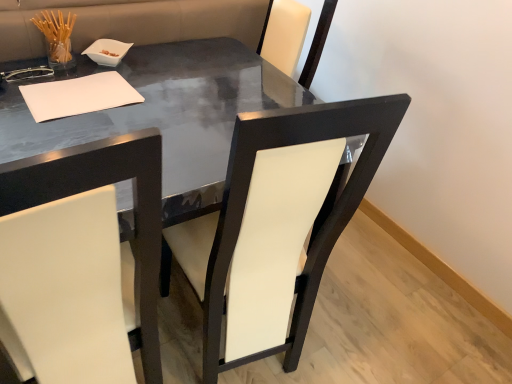
Question: From a real-world perspective, is white leather chair at left, positioned as the second chair in right-to-left order, physically located above or below white leather chair at center, arranged as the 2th chair when viewed from the left?

Choices:
 (A) above
 (B) below

Answer: (B)

Question: Considering the positions of point (44, 188) and point (266, 284), is point (44, 188) closer or farther from the camera than point (266, 284)?

Choices:
 (A) closer
 (B) farther

Answer: (A)

Question: Which of these objects is positioned farthest from the white leather chair at center, which is counted as the 1th chair, starting from the right?

Choices:
 (A) white leather chair at left, which is the first chair in left-to-right order
 (B) glossy black table at center
 (C) white paper at upper left

Answer: (C)

Question: Estimate the real-world distances between objects in this image. Which object is farther from the white leather chair at left, positioned as the second chair in right-to-left order?

Choices:
 (A) glossy black table at center
 (B) white leather chair at center, arranged as the 2th chair when viewed from the left
 (C) white paper at upper left

Answer: (C)